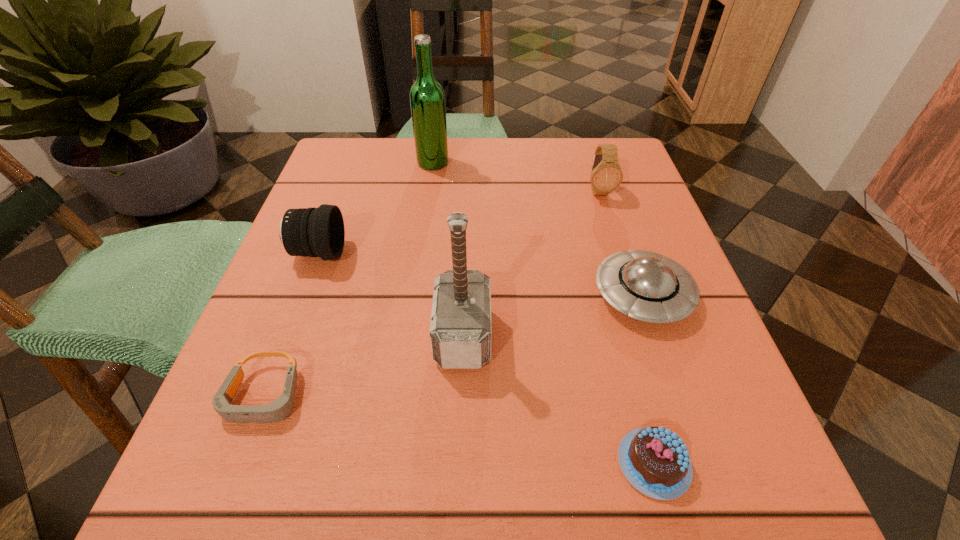
Find the location of a particular element. This screenshot has height=540, width=960. free space located 0.270m for striking with the head of the hammer is located at coordinates (667, 336).

Identify the location of vacant space located on the face of the sixth nearest object. (619, 254).

Where is `free space located at the front element of the telephoto lens`? The image size is (960, 540). free space located at the front element of the telephoto lens is located at coordinates (431, 253).

Identify the location of vacant space located on the back of the fifth tallest object. tap(603, 179).

Where is `free space located on the left of the second shortest object`? Image resolution: width=960 pixels, height=540 pixels. free space located on the left of the second shortest object is located at coordinates (415, 463).

Find the location of a particular element. This screenshot has height=540, width=960. blank space located 0.070m on the front and back of the shortest object is located at coordinates (228, 494).

The width and height of the screenshot is (960, 540). Find the location of `beer bottle that is at the far edge`. beer bottle that is at the far edge is located at coordinates (427, 98).

The width and height of the screenshot is (960, 540). In order to click on watch situated at the far edge in this screenshot , I will do `click(606, 175)`.

Where is `object that is at the near edge`? object that is at the near edge is located at coordinates tap(654, 460).

Locate an element on the screen. The image size is (960, 540). telephoto lens present at the left edge is located at coordinates (315, 232).